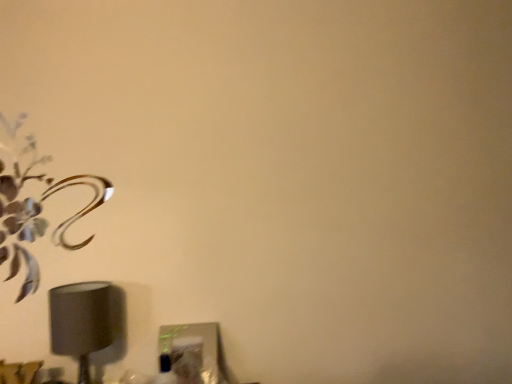
Question: Considering the relative positions of metallic silver flower at upper left and matte gray lampshade at lower left in the image provided, is metallic silver flower at upper left to the left or to the right of matte gray lampshade at lower left?

Choices:
 (A) right
 (B) left

Answer: (B)

Question: In terms of size, does metallic silver flower at upper left appear bigger or smaller than matte gray lampshade at lower left?

Choices:
 (A) big
 (B) small

Answer: (B)

Question: Is metallic silver flower at upper left inside or outside of matte gray lampshade at lower left?

Choices:
 (A) outside
 (B) inside

Answer: (A)

Question: In terms of size, does matte gray lampshade at lower left appear bigger or smaller than metallic silver flower at upper left?

Choices:
 (A) big
 (B) small

Answer: (A)

Question: Looking at their shapes, would you say matte gray lampshade at lower left is wider or thinner than metallic silver flower at upper left?

Choices:
 (A) wide
 (B) thin

Answer: (A)

Question: From the image's perspective, is matte gray lampshade at lower left above or below metallic silver flower at upper left?

Choices:
 (A) above
 (B) below

Answer: (B)

Question: Would you say matte gray lampshade at lower left is to the left or to the right of metallic silver flower at upper left in the picture?

Choices:
 (A) left
 (B) right

Answer: (B)